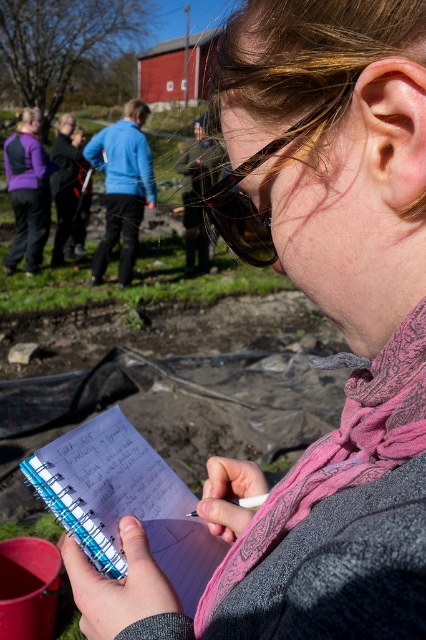
You are a photographer trying to capture the best shot of the scene. You notice two points in the image labeled as point (224, 228) and point (8, 140). Which point should you focus on if you want to ensure that the closer object is in sharp focus?

Point (224, 228) should be focused on because it is closer to the camera than point (8, 140), ensuring the closer object is in sharp focus.

You are a photographer trying to capture the person holding the blue spiral notebook at lower center and the pink fabric scarf at lower center in the same frame. Since you want to ensure both are visible, which object should you focus on first to make sure it doesn

The blue spiral notebook at lower center is below the pink fabric scarf at lower center. To ensure both are visible in the frame, you should focus on the pink fabric scarf at lower center first because it is higher up and might be easier to adjust the camera angle to include the lower positioned notebook.

You are a photographer trying to capture a closeup shot of the blue spiral notebook at lower center and the pink fabric scarf at lower center. Since you want both objects to be clearly visible in the frame, which object should you focus on first to ensure proper focus?

The blue spiral notebook at lower center is shorter than the pink fabric scarf at lower center, so you should focus on the blue spiral notebook at lower center first to ensure proper focus as it is closer to the camera.